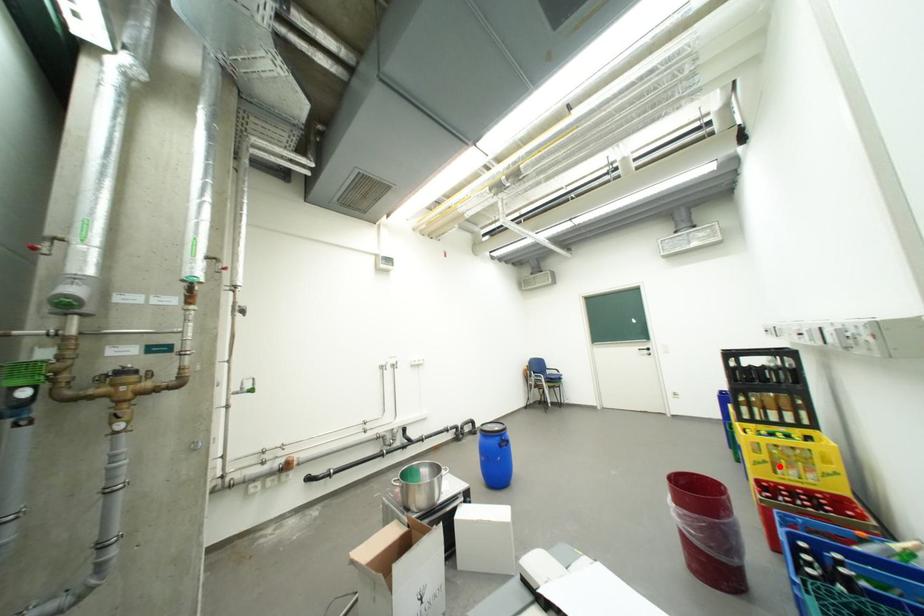
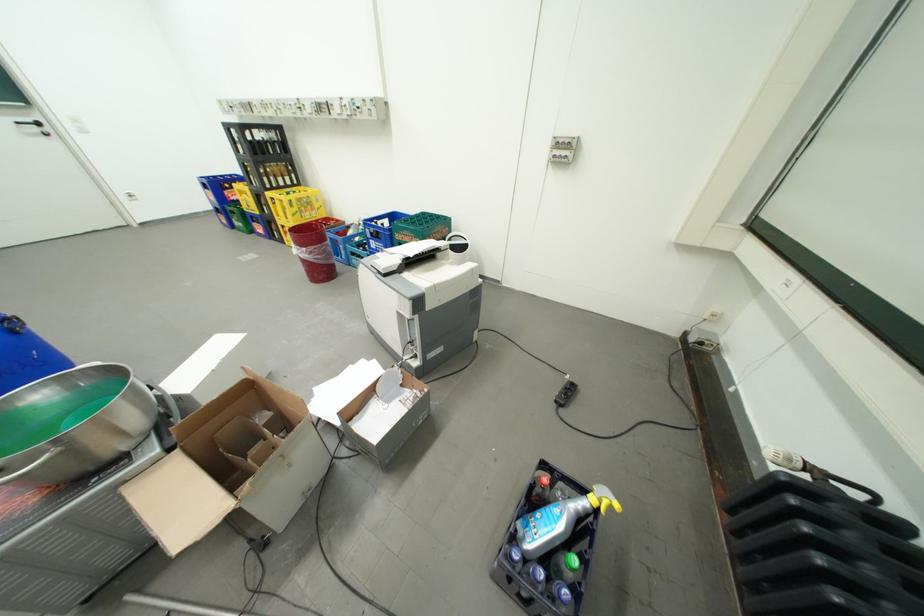
Question: A red point is marked in image1. In image2, is the corresponding 3D point closer to the camera or farther? Reply with the corresponding letter.

Choices:
 (A) The corresponding 3D point is closer.
 (B) The corresponding 3D point is farther.

Answer: (A)